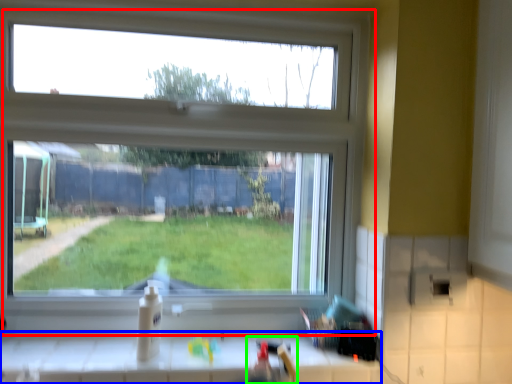
Question: Estimate the real-world distances between objects in this image. Which object is closer to window (highlighted by a red box), counter (highlighted by a blue box) or sink (highlighted by a green box)?

Choices:
 (A) counter
 (B) sink

Answer: (A)